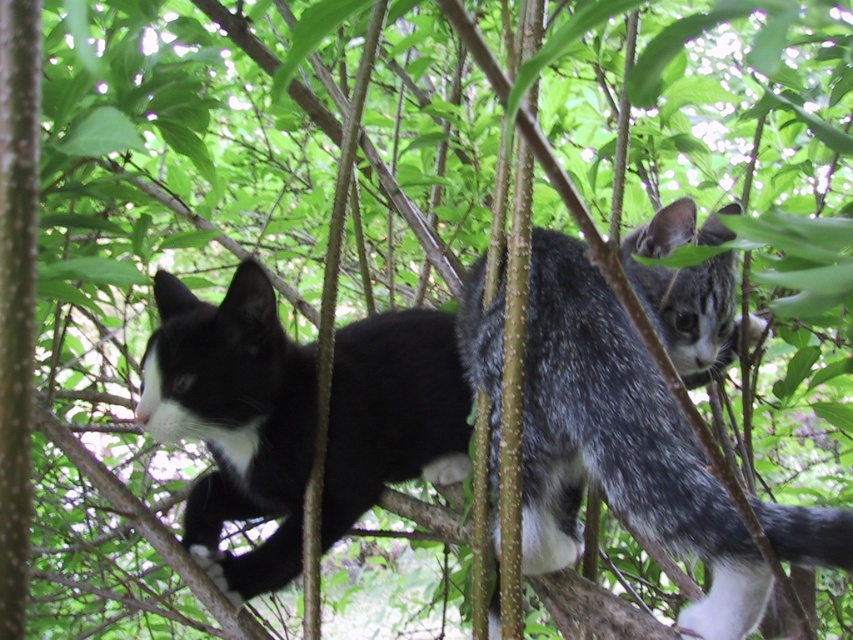
You are standing in a park and see the gray speckled fur cat at upper right in a tree. If you want to throw a ball to the cat, will it reach the cat if you throw it 36 inches forward?

The gray speckled fur cat at upper right is 35.99 inches away from the viewer, so yes, throwing the ball 36 inches forward will reach the cat.

You are a photographer trying to capture a closeup of the cat near point (759, 566). You notice another point at (682, 282). Which point is closer to your camera lens?

Point (759, 566) is closer to the camera than point (682, 282).